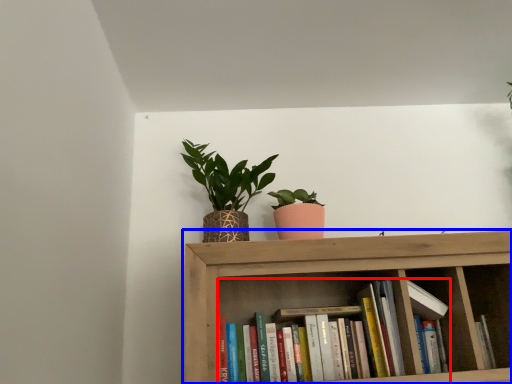
Question: Which point is closer to the camera, book (highlighted by a red box) or shelf (highlighted by a blue box)?

Choices:
 (A) book
 (B) shelf

Answer: (B)